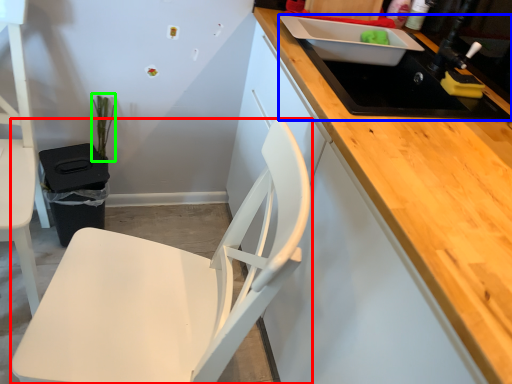
Question: Which object is positioned farthest from chair (highlighted by a red box)? Select from sink (highlighted by a blue box) and plant (highlighted by a green box).

Choices:
 (A) sink
 (B) plant

Answer: (B)